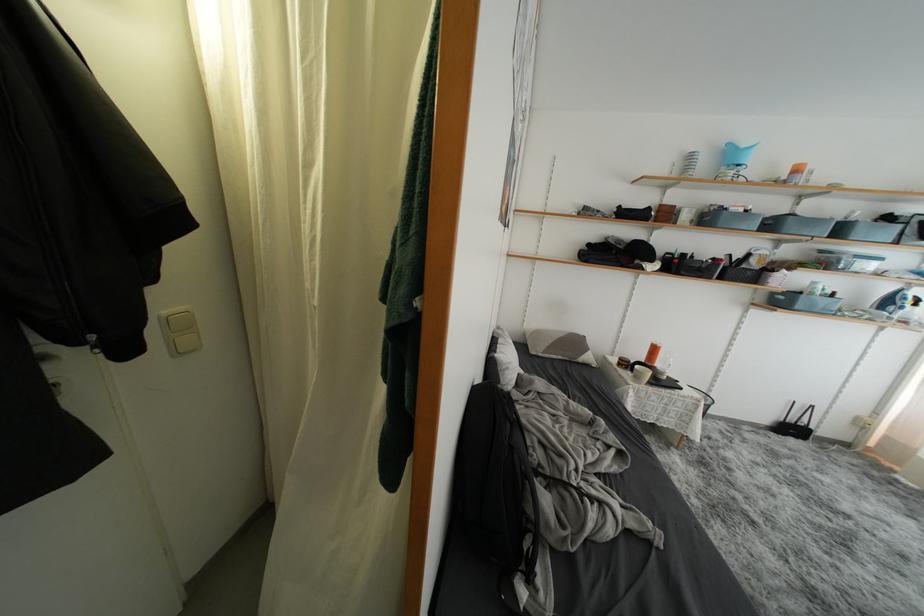
This screenshot has height=616, width=924. I want to click on orange spray can, so click(651, 353).